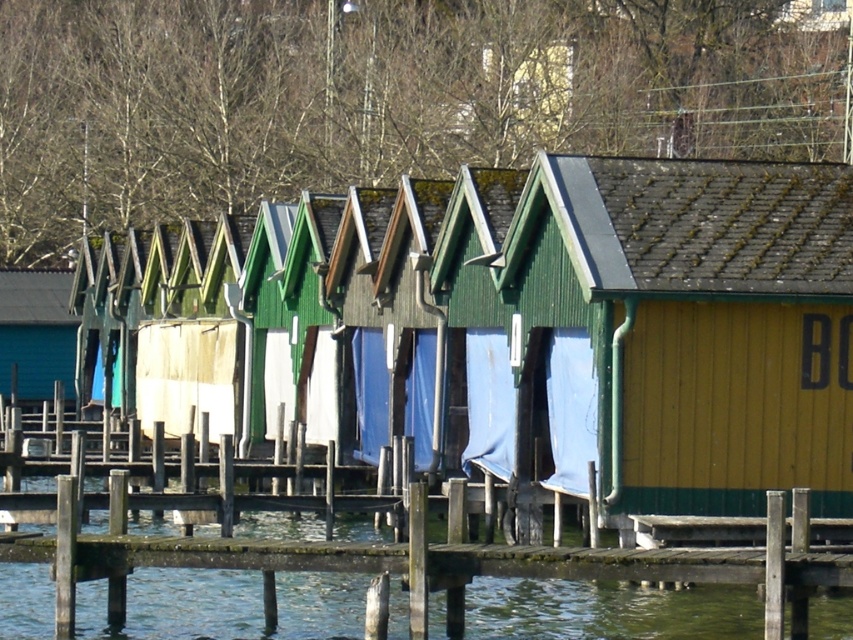
Does yellow wood cabin at right have a lesser width compared to blue fabric at center?

No.

Measure the distance between yellow wood cabin at right and camera.

95.94 feet

This screenshot has height=640, width=853. I want to click on yellow wood cabin at right, so click(x=695, y=323).

Find the location of a particular element. yellow wood cabin at right is located at coordinates (695, 323).